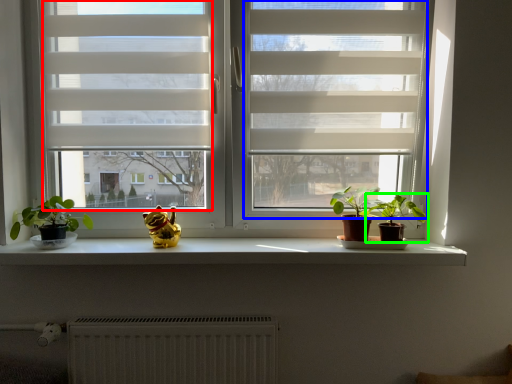
Question: Estimate the real-world distances between objects in this image. Which object is closer to window screen (highlighted by a red box), screen door (highlighted by a blue box) or houseplant (highlighted by a green box)?

Choices:
 (A) screen door
 (B) houseplant

Answer: (A)